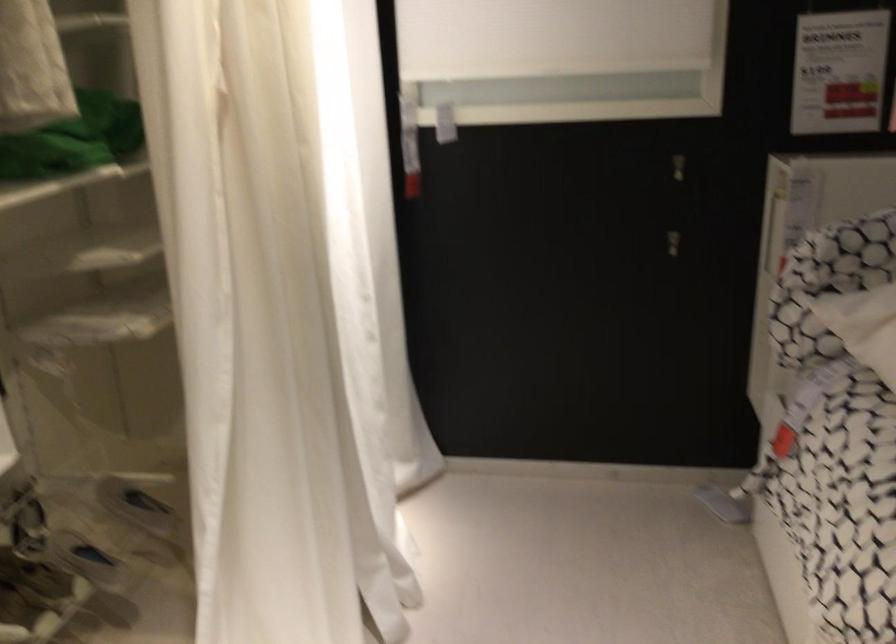
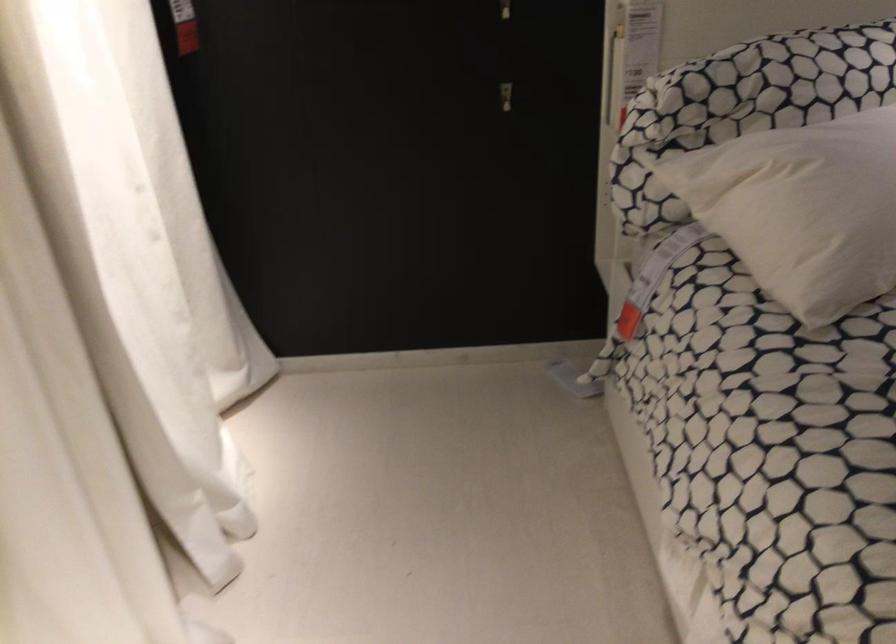
Find the pixel in the second image that matches (780,436) in the first image.

(627, 321)